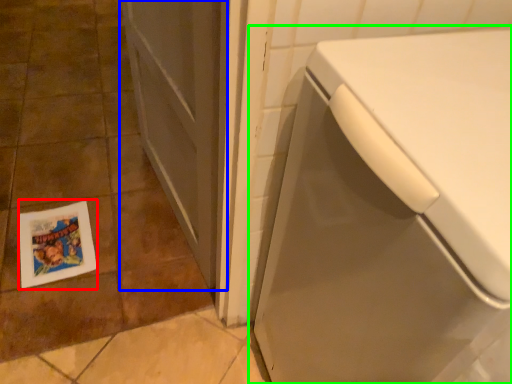
Question: Which is nearer to the flyer (highlighted by a red box)? screen door (highlighted by a blue box) or washing machine (highlighted by a green box).

Choices:
 (A) screen door
 (B) washing machine

Answer: (A)